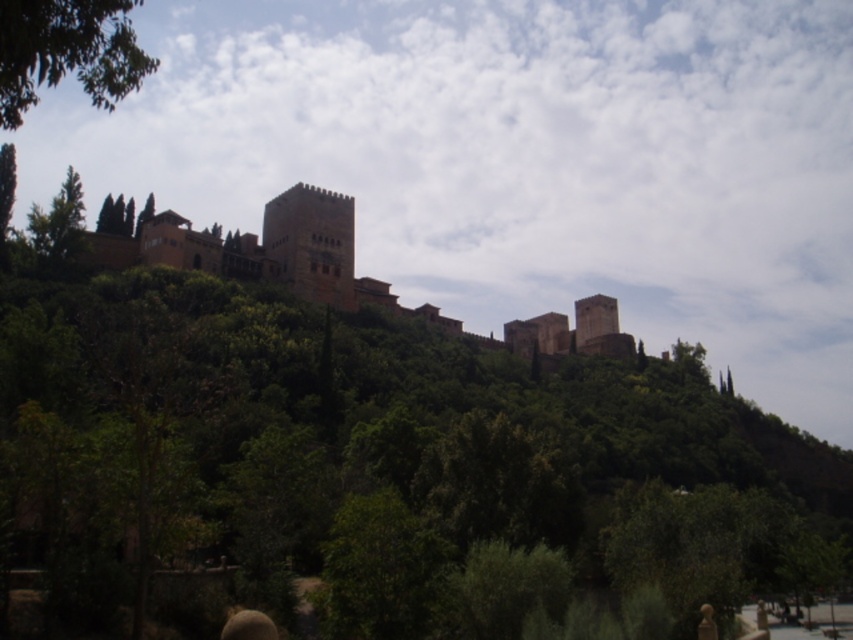
Question: Estimate the real-world distances between objects in this image. Which object is farther from the green leafy tree at upper left?

Choices:
 (A) brown textured head at lower center
 (B) green leafy tree at left

Answer: (B)

Question: Which object is closer to the camera taking this photo?

Choices:
 (A) brown textured head at lower center
 (B) green leafy tree at left
 (C) green leafy tree at upper left

Answer: (C)

Question: Does green leafy tree at upper left have a greater width compared to brown textured head at lower center?

Choices:
 (A) no
 (B) yes

Answer: (B)

Question: Can you confirm if brown textured head at lower center is positioned below green leafy tree at left?

Choices:
 (A) yes
 (B) no

Answer: (A)

Question: Is green leafy tree at upper left to the left of green leafy tree at left from the viewer's perspective?

Choices:
 (A) yes
 (B) no

Answer: (B)

Question: Which object is the closest to the brown stone castle at center?

Choices:
 (A) brown textured head at lower center
 (B) green leafy tree at upper left

Answer: (B)